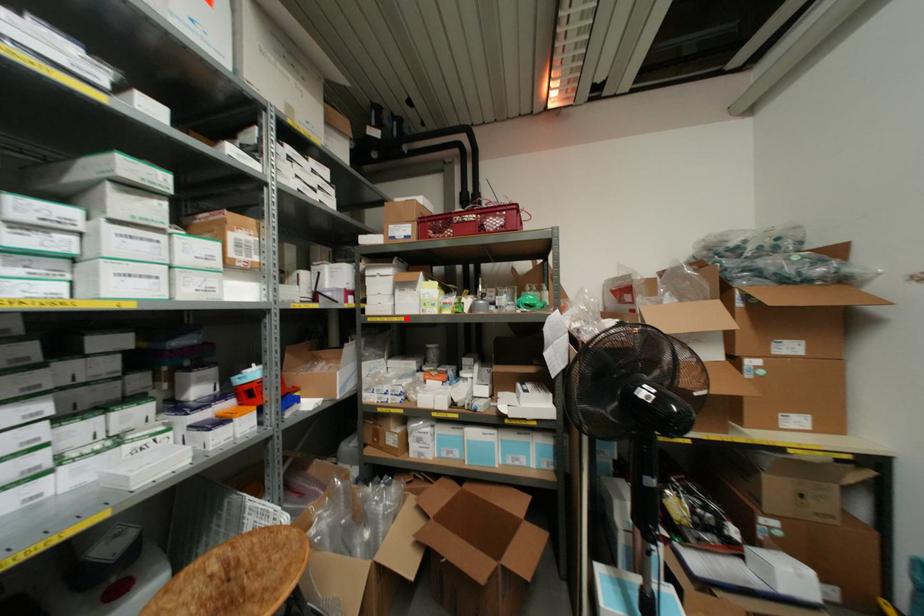
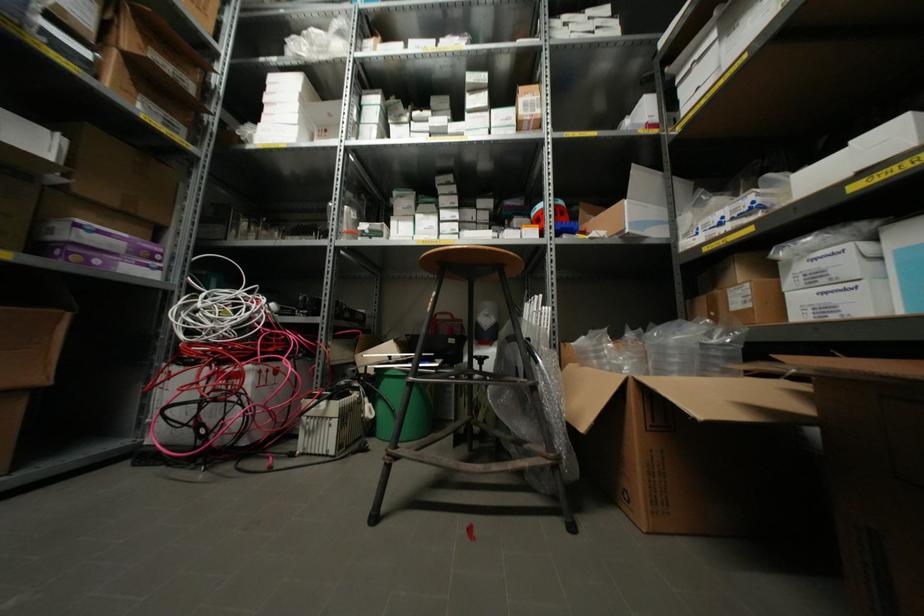
In the second image, find the point that corresponds to the highlighted location in the first image.

(743, 55)